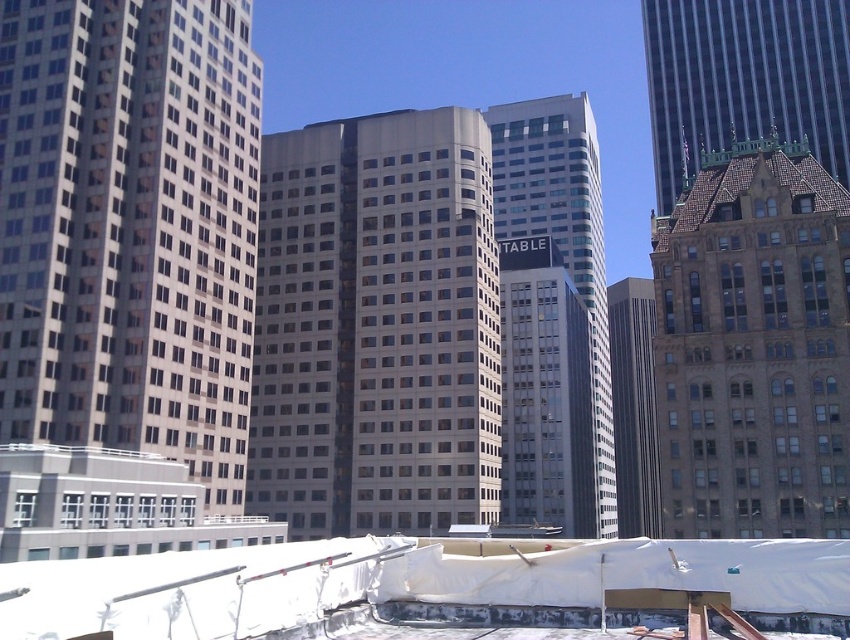
Does point (463, 609) come behind point (656, 472)?

No, it is in front of (656, 472).

Identify the location of white fabric at lower center. (434, 589).

Identify the location of white fabric at lower center. Image resolution: width=850 pixels, height=640 pixels. (434, 589).

In the scene shown: Is gray glass skyscraper at center wider than brown glassy building at center-right?

Incorrect, gray glass skyscraper at center's width does not surpass brown glassy building at center-right's.

Which is more to the left, gray glass skyscraper at center or brown glassy building at center-right?

Positioned to the left is gray glass skyscraper at center.

Who is more forward, (491, 113) or (646, 529)?

Positioned in front is point (491, 113).

Find the location of a particular element. Image resolution: width=850 pixels, height=640 pixels. gray glass skyscraper at center is located at coordinates (562, 232).

Between white fabric at lower center and brown stone building at right, which one has more height?

Standing taller between the two is brown stone building at right.

Is point (650, 564) positioned in front of point (785, 403)?

Yes, it is.

This screenshot has height=640, width=850. What are the coordinates of `white fabric at lower center` in the screenshot? It's located at (434, 589).